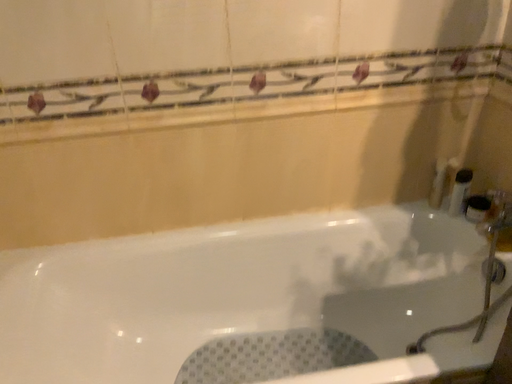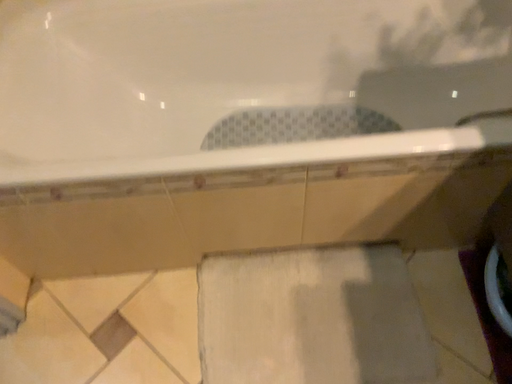
Question: How did the camera likely rotate when shooting the video?

Choices:
 (A) rotated downward
 (B) rotated upward

Answer: (A)